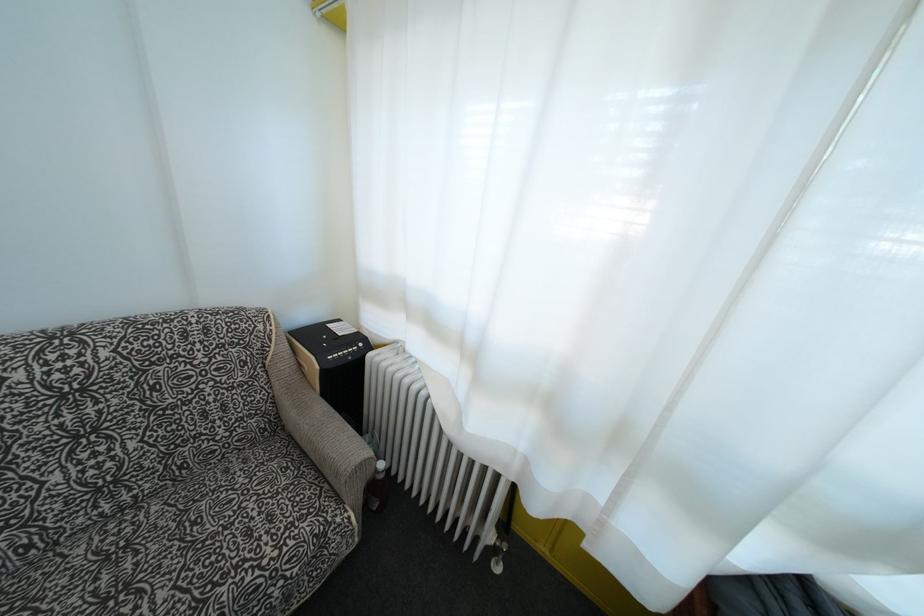
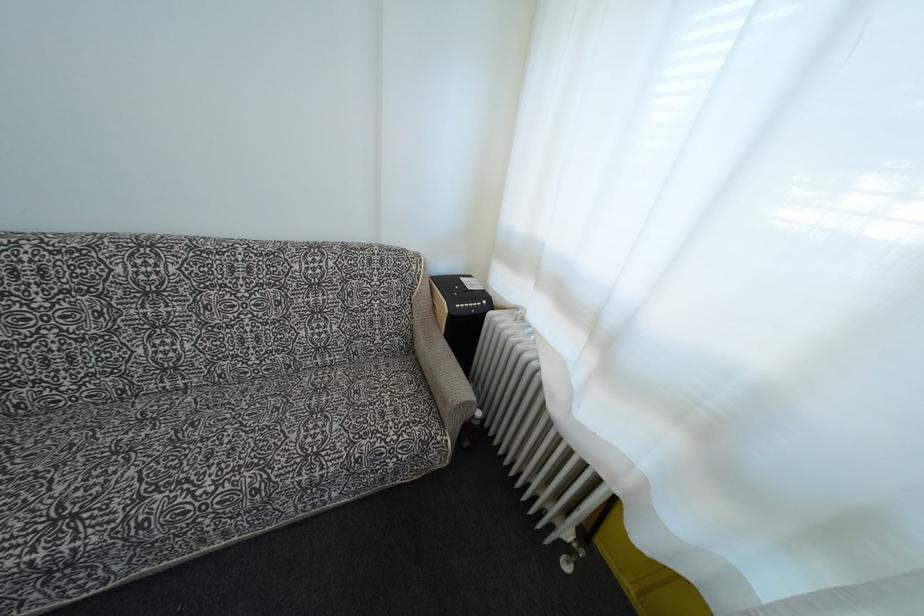
The point at (289, 533) is marked in the first image. Where is the corresponding point in the second image?

(407, 430)